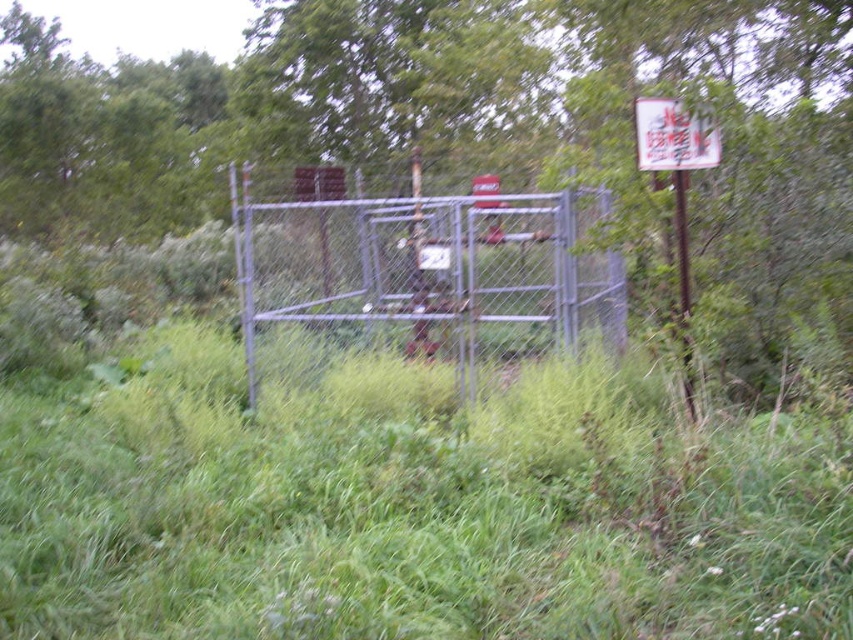
You are a hiker who has stumbled upon this fenced area. You notice a green leafy tree at upper center and a white paper sign at upper right. Which object is larger in size?

The green leafy tree at upper center is bigger than the white paper sign at upper right.

You are a gardener assessing the vegetation in the fenced area. You notice the green grass at center and the green leafy tree at upper center. Which of these two has a greater height?

The green leafy tree at upper center has a greater height than the green grass at center.